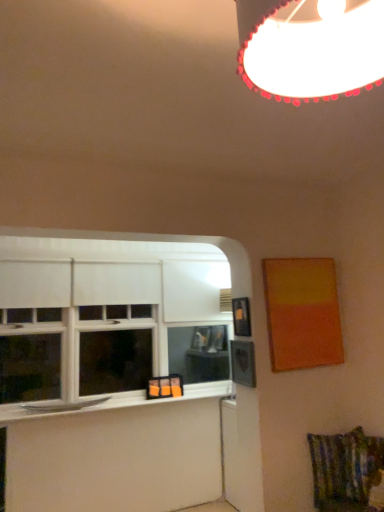
The width and height of the screenshot is (384, 512). In order to click on free space above white glossy window sill at lower left (from a real-world perspective) in this screenshot , I will do `click(126, 400)`.